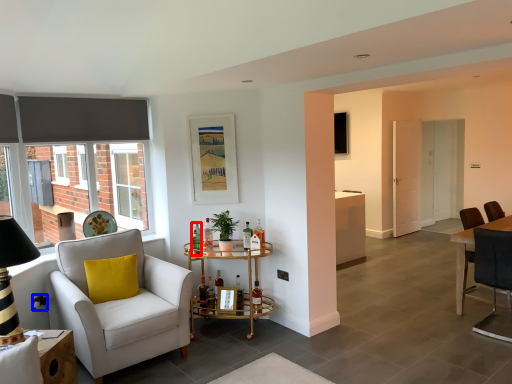
Question: Which point is closer to the camera, bottle (highlighted by a red box) or power outlet (highlighted by a blue box)?

Choices:
 (A) bottle
 (B) power outlet

Answer: (B)